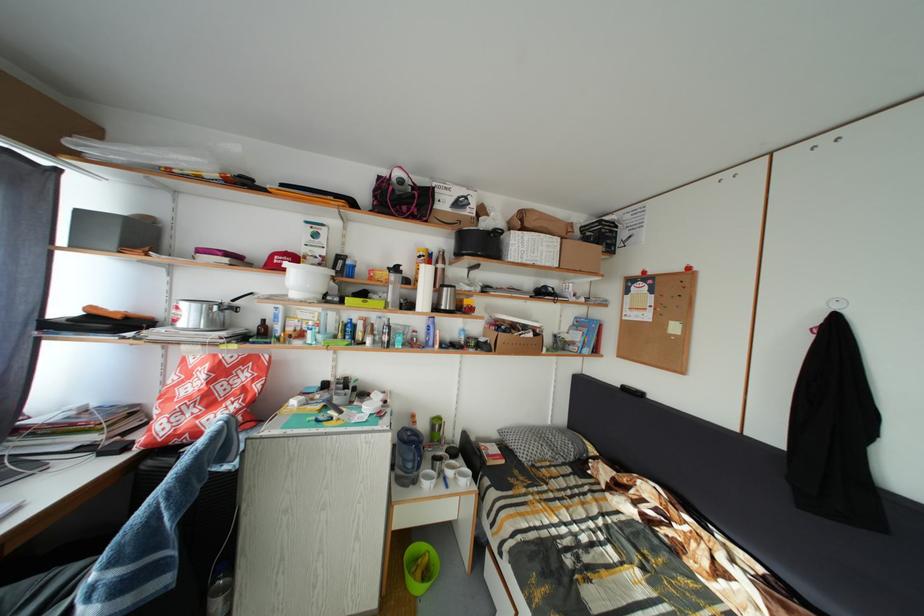
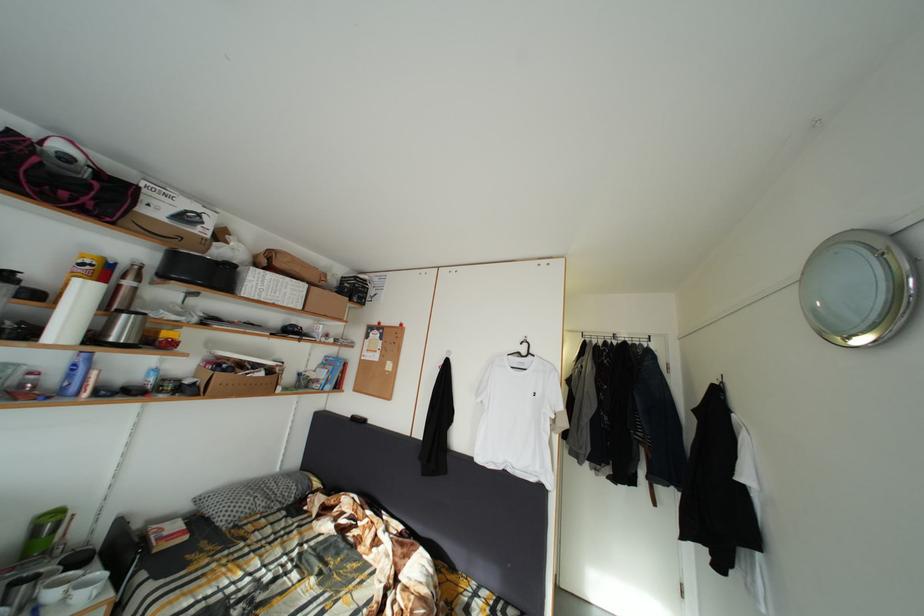
The point at (442, 434) is marked in the first image. Where is the corresponding point in the second image?

(44, 537)